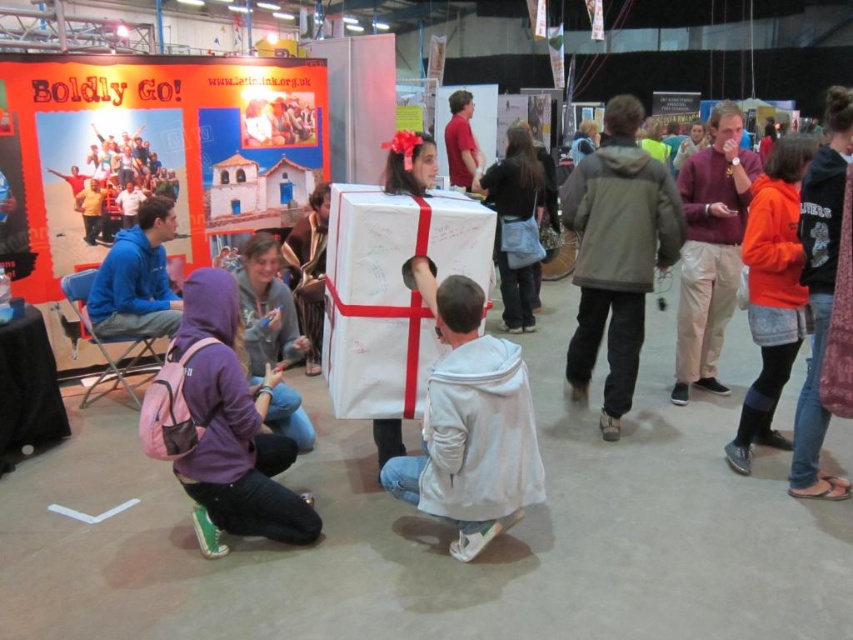
You are at the event and want to take a photo of the matte red shirt at upper center without the orange fleece jacket at right blocking it. How should you position yourself?

Move to the side opposite the orange fleece jacket at right to avoid it blocking the matte red shirt at upper center.

You are organizing a photo shoot and need to position the gray fabric jacket at center and the matte red shirt at upper center in a way that allows both to be visible in the frame. Based on their positions and sizes, which object should be placed closer to the camera to ensure both are fully visible?

The gray fabric jacket at center should be placed closer to the camera since it might be wider than the matte red shirt at upper center, ensuring both fit within the frame.

From the picture: You are organizing a photo shoot and need to ensure that all participants are visible in the frame. Given that the matte red shirt at upper center and the orange fleece jacket at right are both in the scene, which one might require a wider lens to capture fully?

The orange fleece jacket at right is bigger than the matte red shirt at upper center, so it would require a wider lens to capture fully.